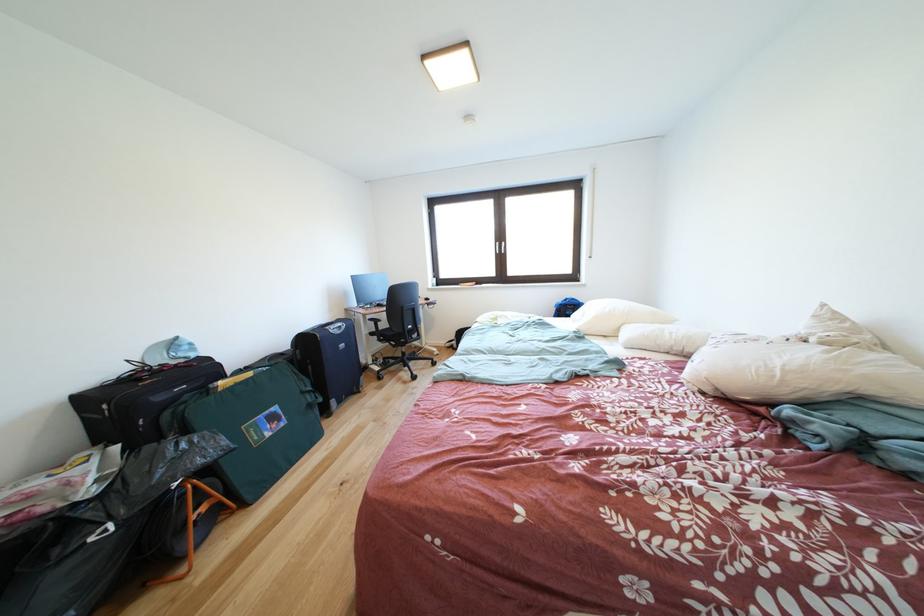
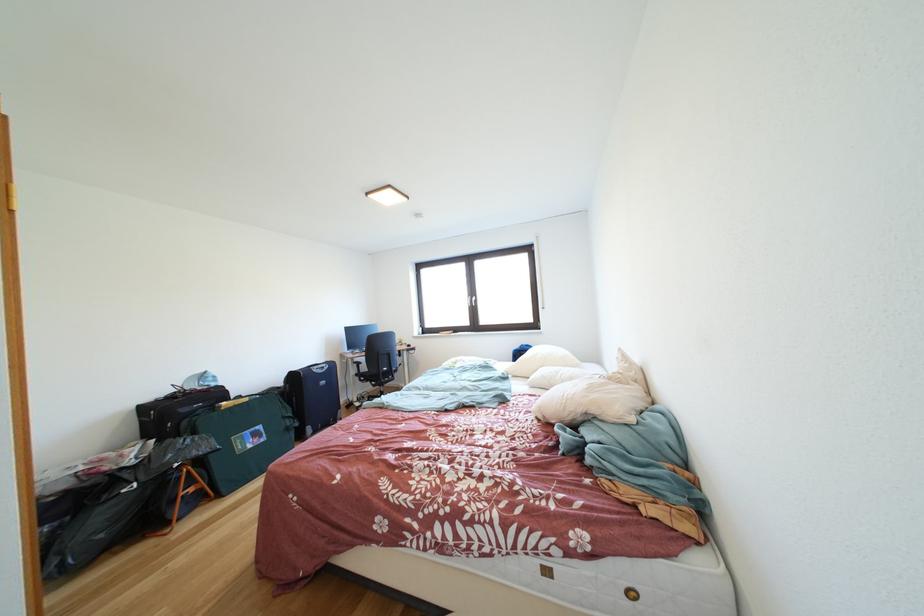
Question: I am providing you with two images of the same scene from different viewpoints. Which of the following objects are not visible in image2?

Choices:
 (A) white pillow
 (B) blue suitcase handle
 (C) black suitcase handle
 (D) drink can

Answer: (A)